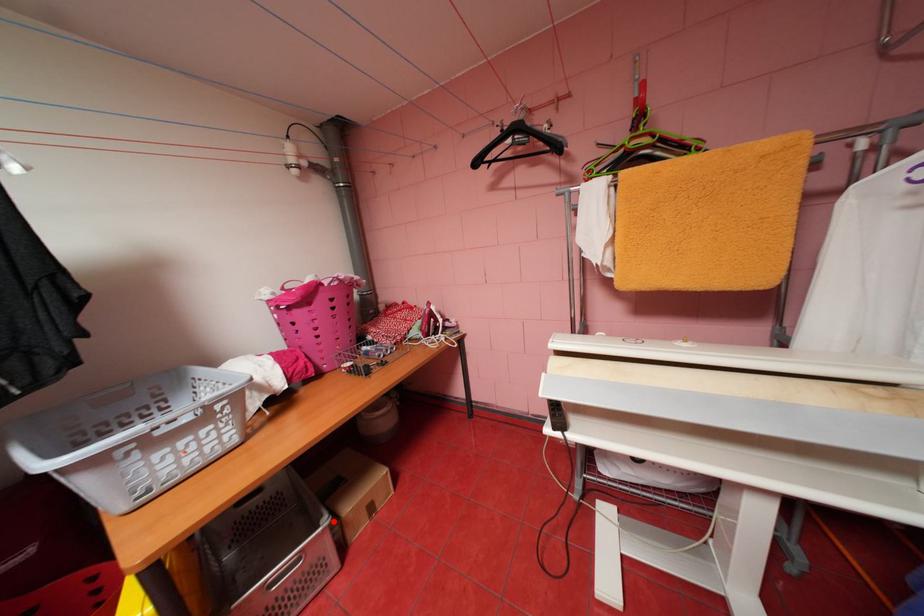
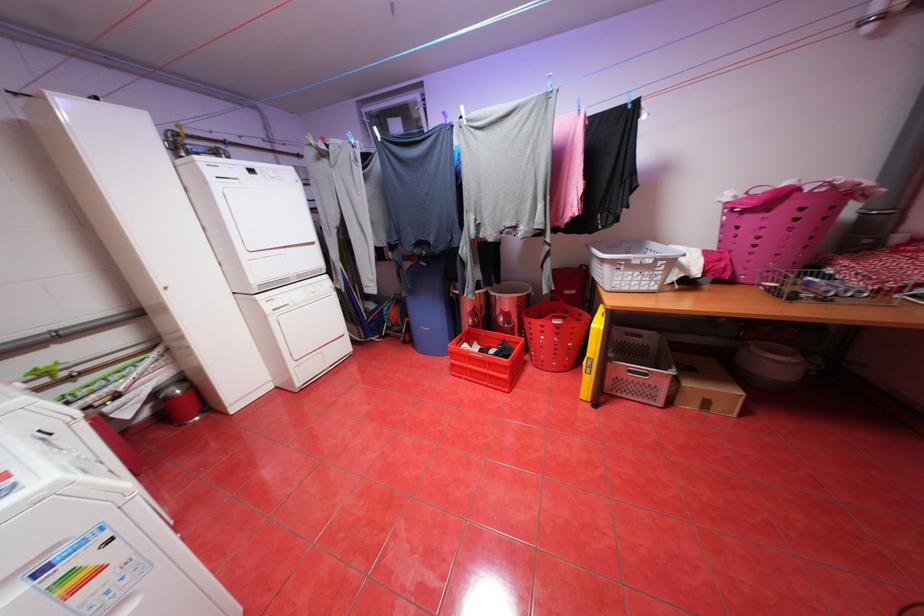
Find the pixel in the second image that matches the highlighted location in the first image.

(681, 371)